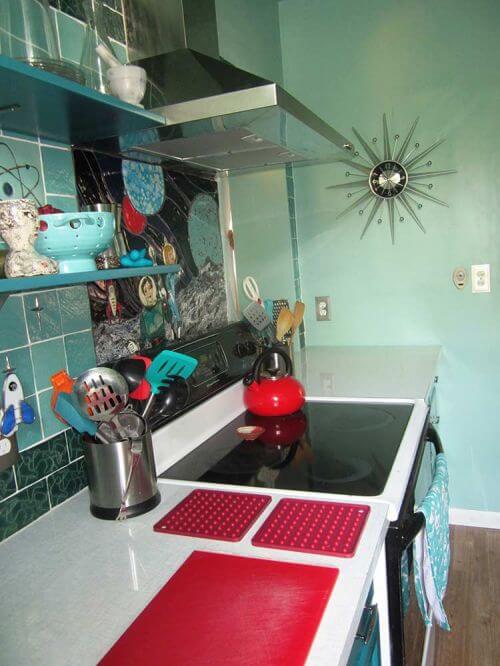
This screenshot has height=666, width=500. Find the location of `wall`. wall is located at coordinates (397, 300).